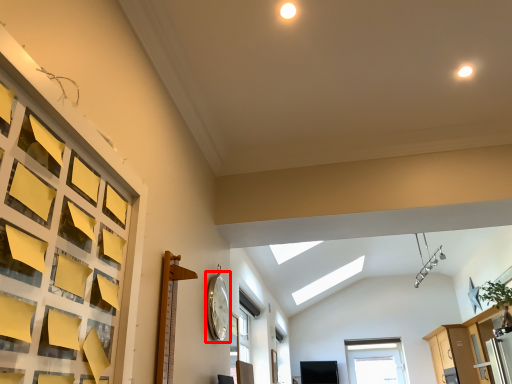
Question: In this image, where is clock (annotated by the red box) located relative to dresser?

Choices:
 (A) right
 (B) left

Answer: (B)